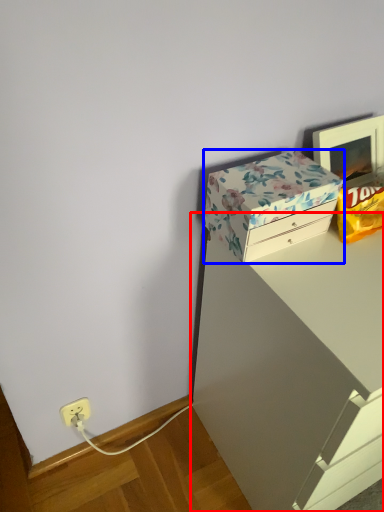
Question: Which of the following is the closest to the observer, vanity (highlighted by a red box) or box (highlighted by a blue box)?

Choices:
 (A) vanity
 (B) box

Answer: (A)